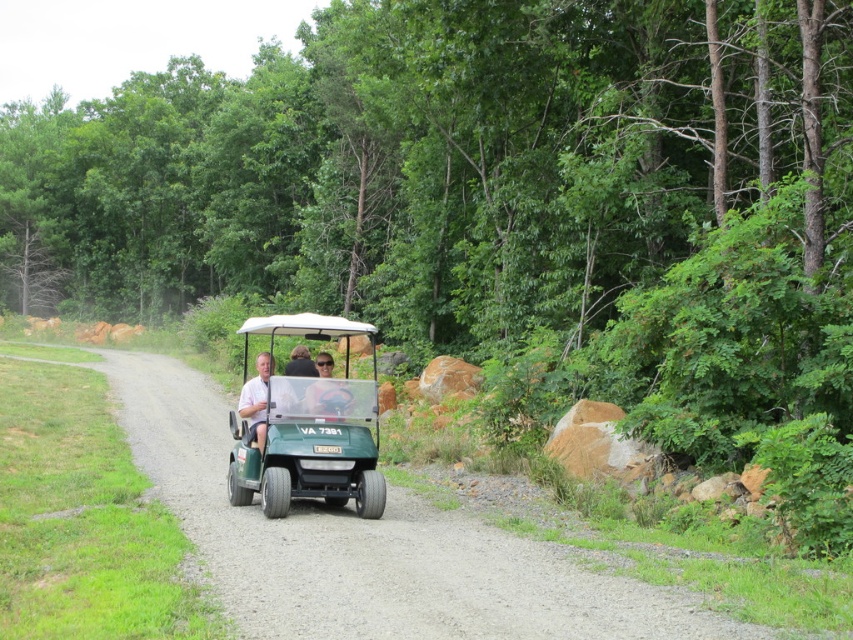
What do you see at coordinates (305, 428) in the screenshot? I see `green matte golf cart at center` at bounding box center [305, 428].

Who is more forward, (329, 330) or (257, 387)?

Point (329, 330) is in front.

Who is more distant from viewer, (x=239, y=499) or (x=253, y=403)?

The point (x=239, y=499) is behind.

Where is `green matte golf cart at center`? The image size is (853, 640). green matte golf cart at center is located at coordinates pos(305,428).